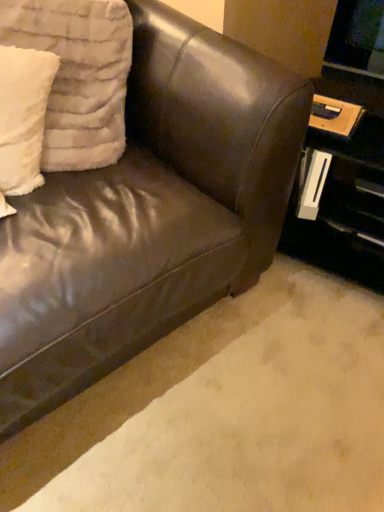
Question: From a real-world perspective, does white fluffy pillow at upper left, the 2th pillow viewed from the right, stand above brown leather couch at lower left?

Choices:
 (A) no
 (B) yes

Answer: (B)

Question: Is white fluffy pillow at upper left, the 2th pillow viewed from the right, behind brown leather couch at lower left?

Choices:
 (A) no
 (B) yes

Answer: (B)

Question: From a real-world perspective, is white fluffy pillow at upper left, the 2th pillow viewed from the right, located beneath brown leather couch at lower left?

Choices:
 (A) no
 (B) yes

Answer: (A)

Question: Does white fluffy pillow at upper left, the 2th pillow viewed from the right, come in front of brown leather couch at lower left?

Choices:
 (A) yes
 (B) no

Answer: (B)

Question: From the image's perspective, is white fluffy pillow at upper left, the 2th pillow viewed from the right, below brown leather couch at lower left?

Choices:
 (A) yes
 (B) no

Answer: (B)

Question: From a real-world perspective, relative to brown leather couch at upper left, is white fluffy pillow at upper left, acting as the second pillow starting from the left, vertically above or below?

Choices:
 (A) below
 (B) above

Answer: (B)

Question: Considering the positions of point (100, 17) and point (99, 286), is point (100, 17) closer or farther from the camera than point (99, 286)?

Choices:
 (A) farther
 (B) closer

Answer: (A)

Question: Is white fluffy pillow at upper left, acting as the second pillow starting from the left, wider or thinner than brown leather couch at upper left?

Choices:
 (A) thin
 (B) wide

Answer: (A)

Question: Considering the relative positions of white fluffy pillow at upper left, acting as the second pillow starting from the left, and brown leather couch at upper left in the image provided, is white fluffy pillow at upper left, acting as the second pillow starting from the left, to the left or to the right of brown leather couch at upper left?

Choices:
 (A) left
 (B) right

Answer: (A)

Question: From a real-world perspective, is matte black table at right above or below white fluffy pillow at upper left, which is the first pillow in right-to-left order?

Choices:
 (A) above
 (B) below

Answer: (B)

Question: Is matte black table at right in front of or behind white fluffy pillow at upper left, which is the first pillow in right-to-left order, in the image?

Choices:
 (A) front
 (B) behind

Answer: (B)

Question: From the image's perspective, is matte black table at right located above or below white fluffy pillow at upper left, which is the first pillow in right-to-left order?

Choices:
 (A) above
 (B) below

Answer: (B)

Question: In terms of width, does matte black table at right look wider or thinner when compared to white fluffy pillow at upper left, which is the first pillow in right-to-left order?

Choices:
 (A) thin
 (B) wide

Answer: (B)

Question: Looking at the image, does brown leather couch at lower left seem bigger or smaller compared to matte black table at right?

Choices:
 (A) big
 (B) small

Answer: (B)

Question: Considering the positions of brown leather couch at lower left and matte black table at right in the image, is brown leather couch at lower left wider or thinner than matte black table at right?

Choices:
 (A) thin
 (B) wide

Answer: (B)